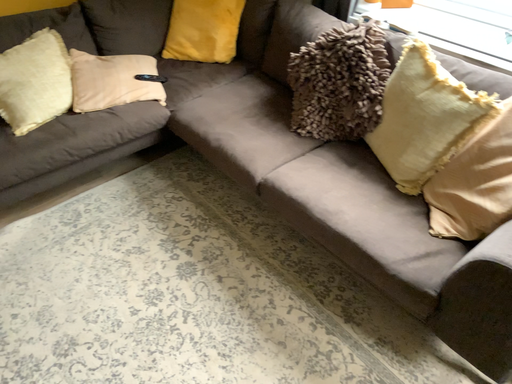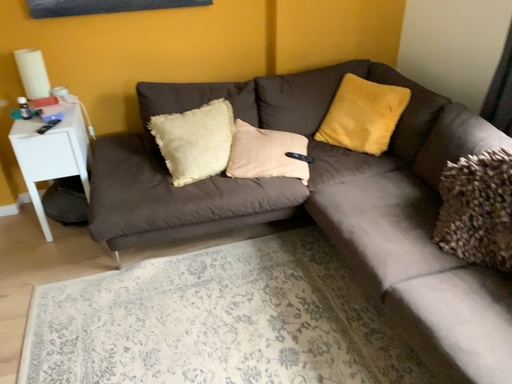
Question: How did the camera likely rotate when shooting the video?

Choices:
 (A) rotated downward
 (B) rotated upward

Answer: (B)